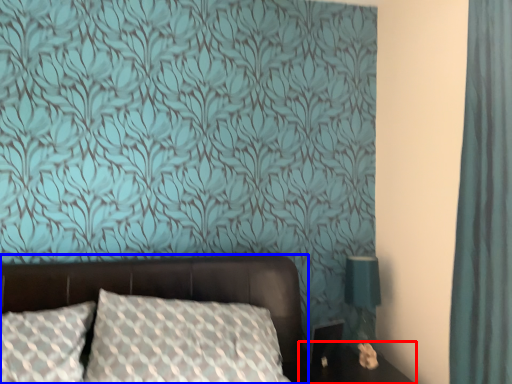
Question: Which object is further to the camera taking this photo, table (highlighted by a red box) or bed (highlighted by a blue box)?

Choices:
 (A) table
 (B) bed

Answer: (A)